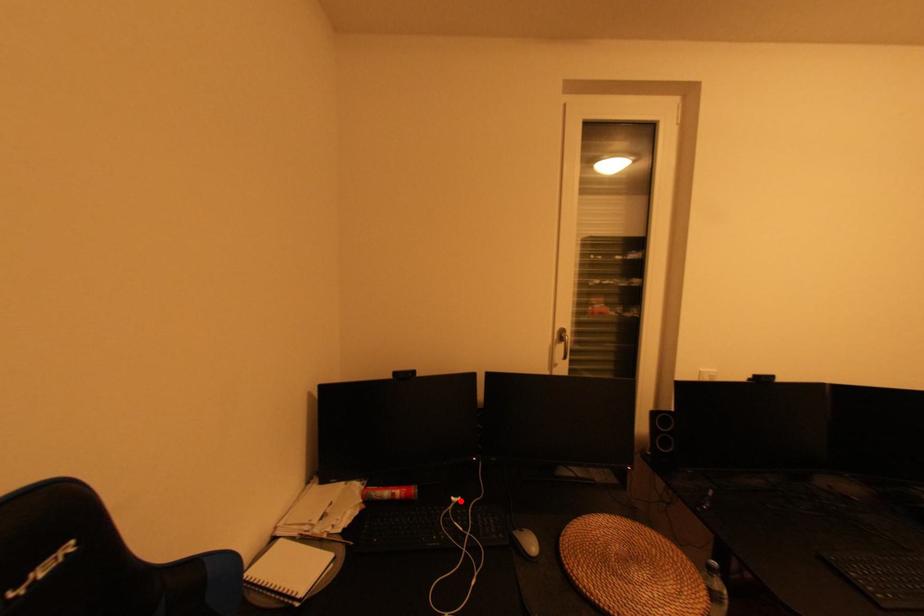
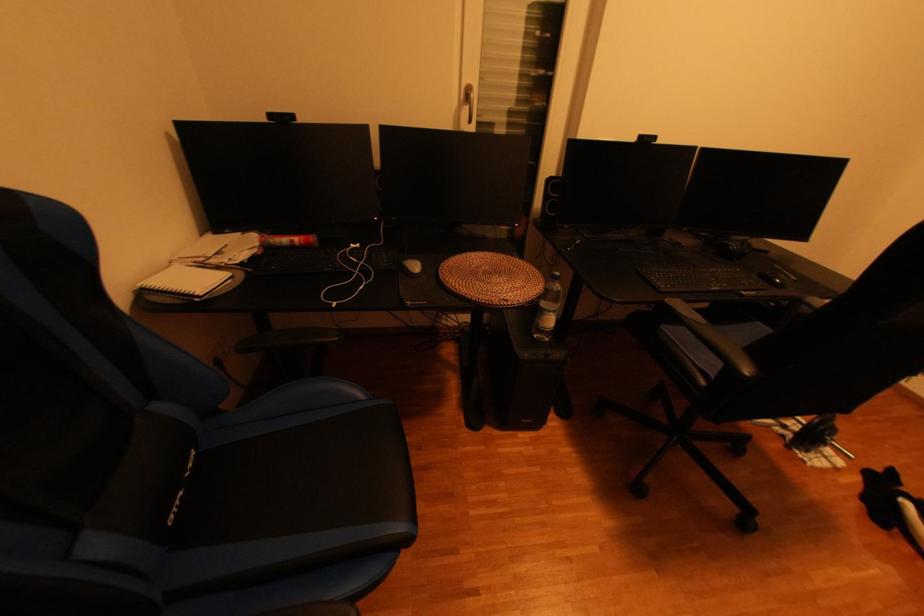
In the second image, find the point that corresponds to the highlighted location in the first image.

(359, 246)